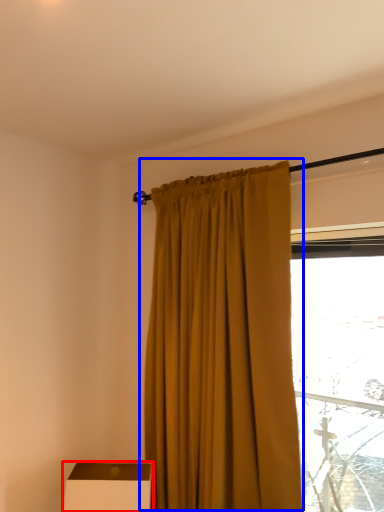
Question: Which of the following is the closest to the observer, furniture (highlighted by a red box) or curtain (highlighted by a blue box)?

Choices:
 (A) furniture
 (B) curtain

Answer: (B)